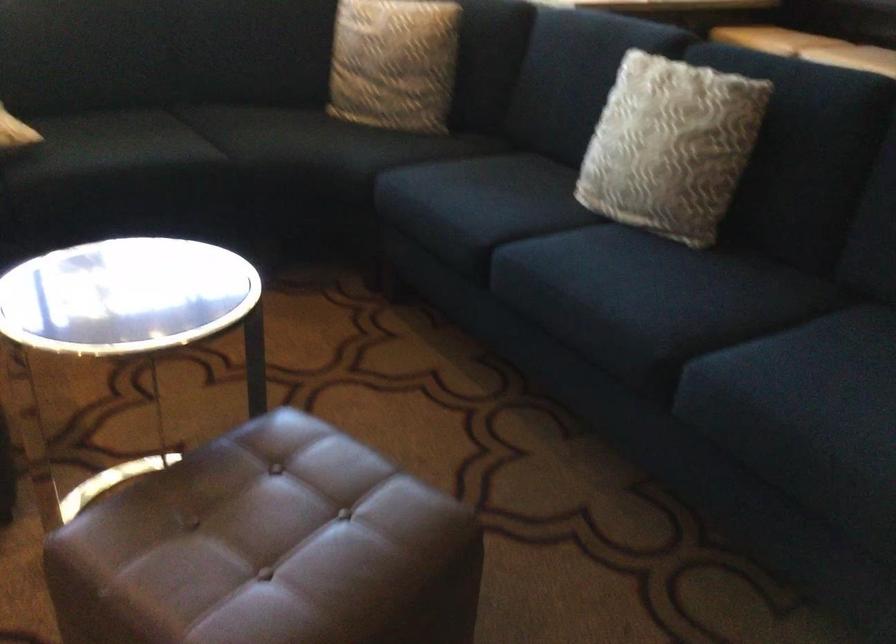
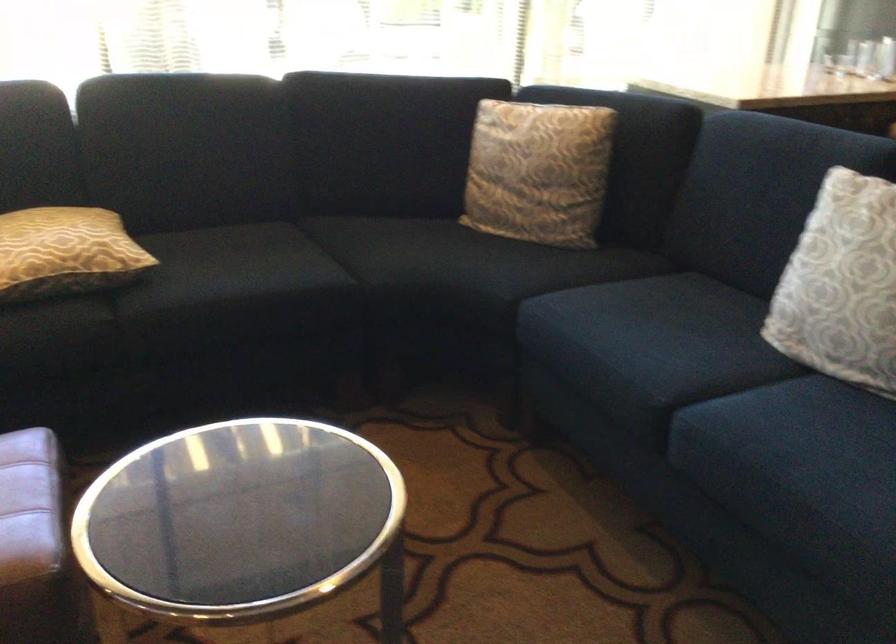
Question: The camera is either moving clockwise (left) or counter-clockwise (right) around the object. The first image is from the beginning of the video and the second image is from the end. Is the camera moving left or right when shooting the video?

Choices:
 (A) Left
 (B) Right

Answer: (B)